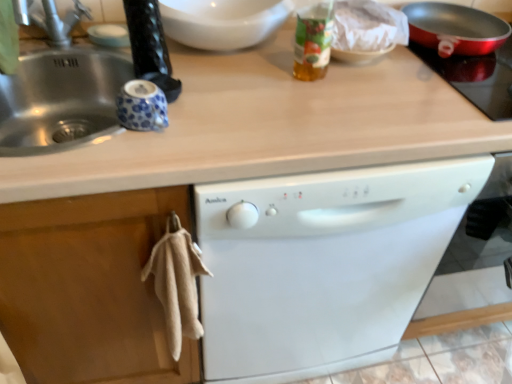
Question: In terms of width, does white glossy bowl at upper center look wider or thinner when compared to silver metallic faucet at upper left?

Choices:
 (A) wide
 (B) thin

Answer: (B)

Question: In the image, is white glossy bowl at upper center positioned in front of or behind silver metallic faucet at upper left?

Choices:
 (A) behind
 (B) front

Answer: (A)

Question: Estimate the real-world distances between objects in this image. Which object is farther from the white glossy bowl at upper center?

Choices:
 (A) translucent plastic bottle at upper center
 (B) metallic red pan at upper right
 (C) silver metallic faucet at upper left
 (D) white glossy dishwasher at center

Answer: (D)

Question: Which of these objects is positioned farthest from the silver metallic faucet at upper left?

Choices:
 (A) white glossy dishwasher at center
 (B) translucent plastic bottle at upper center
 (C) white glossy bowl at upper center
 (D) metallic red pan at upper right

Answer: (D)